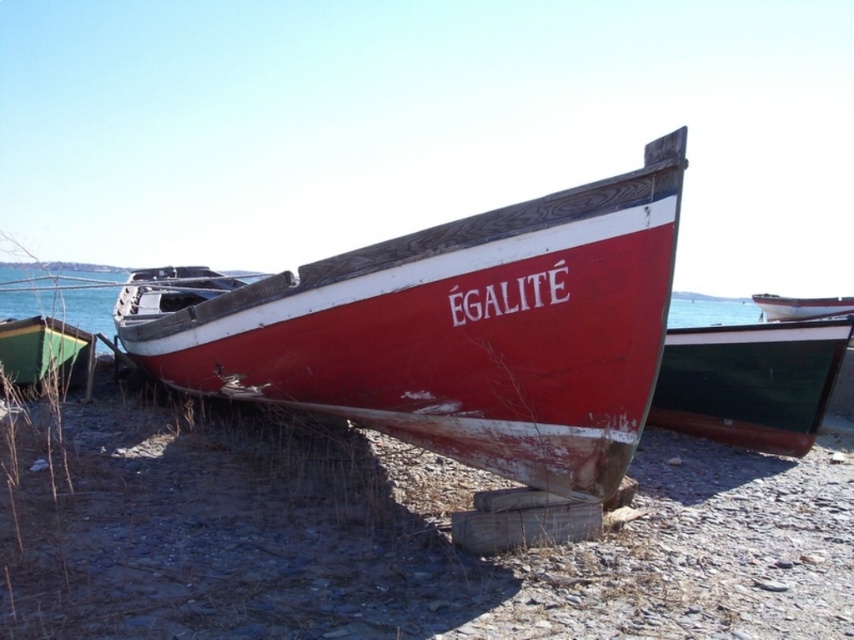
Question: Which point is farther from the camera taking this photo?

Choices:
 (A) (645, 301)
 (B) (781, 317)

Answer: (B)

Question: Which point is closer to the camera?

Choices:
 (A) (10, 369)
 (B) (720, 348)

Answer: (A)

Question: Is rusty wood boat at center closer to the viewer compared to dark green polished wood boat at right?

Choices:
 (A) yes
 (B) no

Answer: (A)

Question: Does dark green polished wood boat at right lie in front of green matte boat at lower left?

Choices:
 (A) no
 (B) yes

Answer: (B)

Question: Which object appears closest to the camera in this image?

Choices:
 (A) green matte boat at lower left
 (B) dark green polished wood boat at right
 (C) white glossy boat at right

Answer: (B)

Question: Can you confirm if rusty wood boat at center is thinner than dark green polished wood boat at right?

Choices:
 (A) yes
 (B) no

Answer: (B)